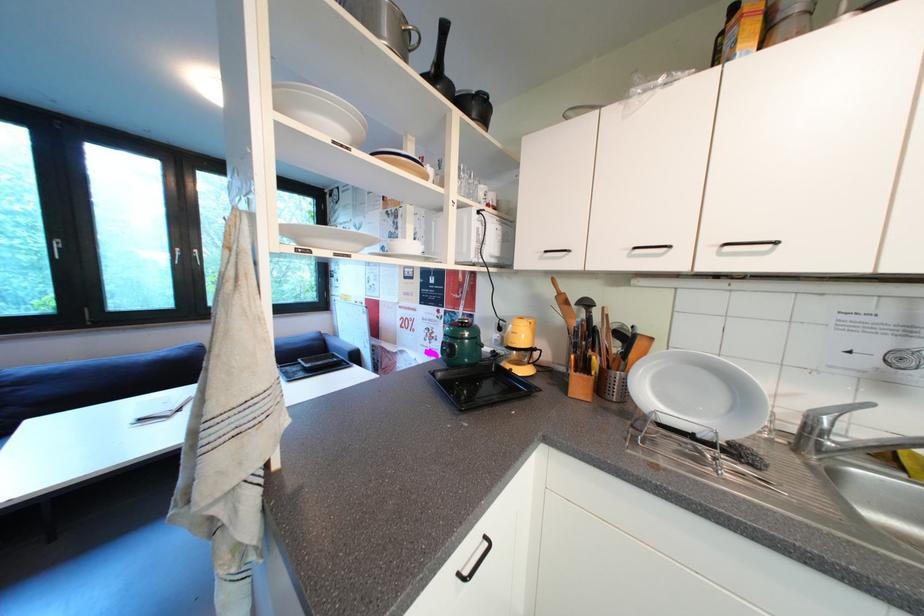
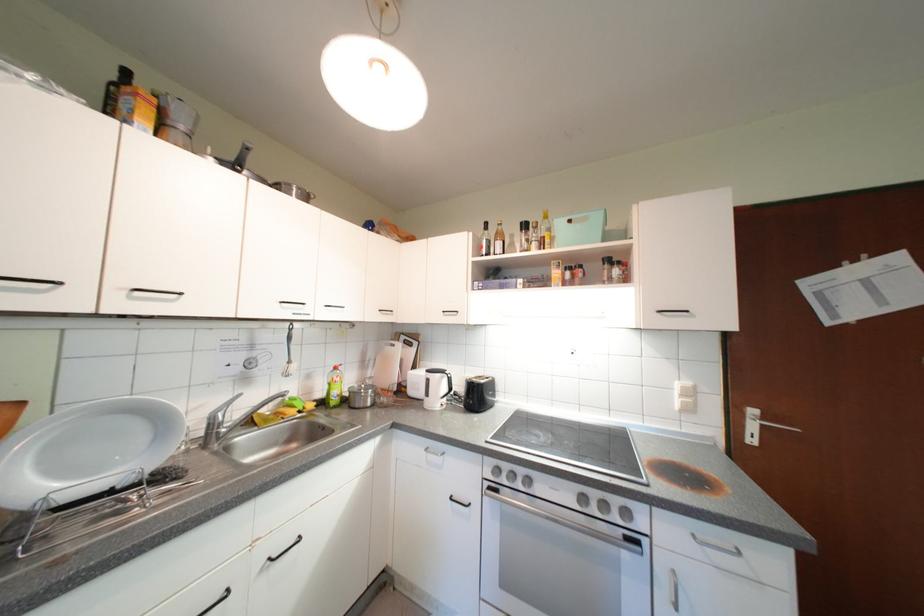
The point at (670, 399) is marked in the first image. Where is the corresponding point in the second image?

(64, 475)